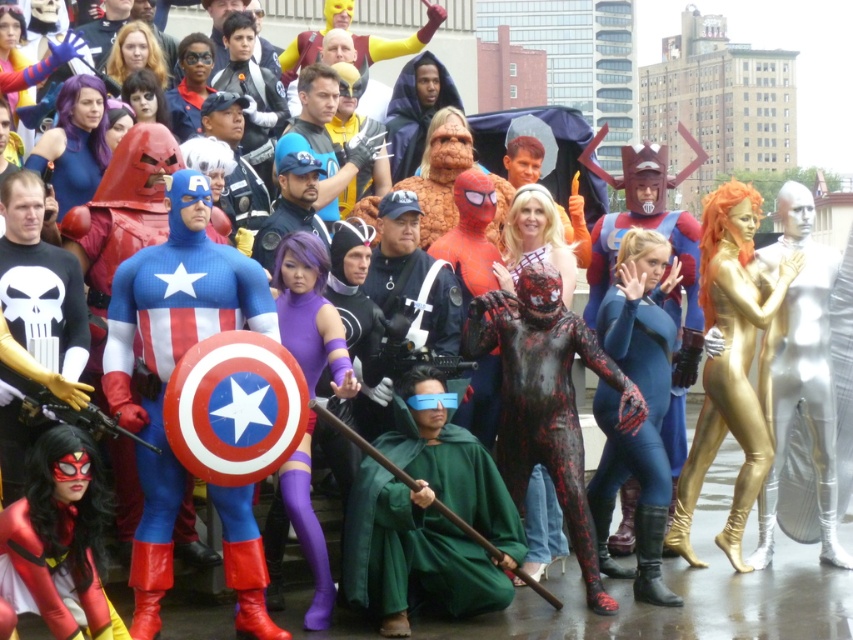
Where is the shiny spandex suit at center located in the image?

The shiny spandex suit at center is located at the point with coordinates 0.562 on the x axis and 0.202 on the y axis.